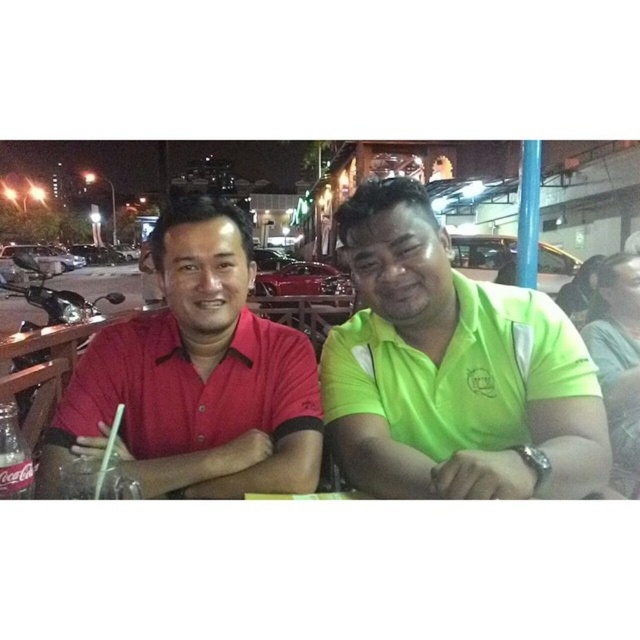
Question: Can you confirm if green matte shirt at center is positioned to the right of matte red shirt at left?

Choices:
 (A) no
 (B) yes

Answer: (B)

Question: Is green matte shirt at center in front of matte red shirt at left?

Choices:
 (A) no
 (B) yes

Answer: (B)

Question: Can you confirm if green matte shirt at center is bigger than matte red shirt at left?

Choices:
 (A) no
 (B) yes

Answer: (A)

Question: Which object is closer to the camera taking this photo?

Choices:
 (A) green matte shirt at center
 (B) matte red shirt at left

Answer: (A)

Question: Among these points, which one is nearest to the camera?

Choices:
 (A) (161, 280)
 (B) (529, 481)

Answer: (B)